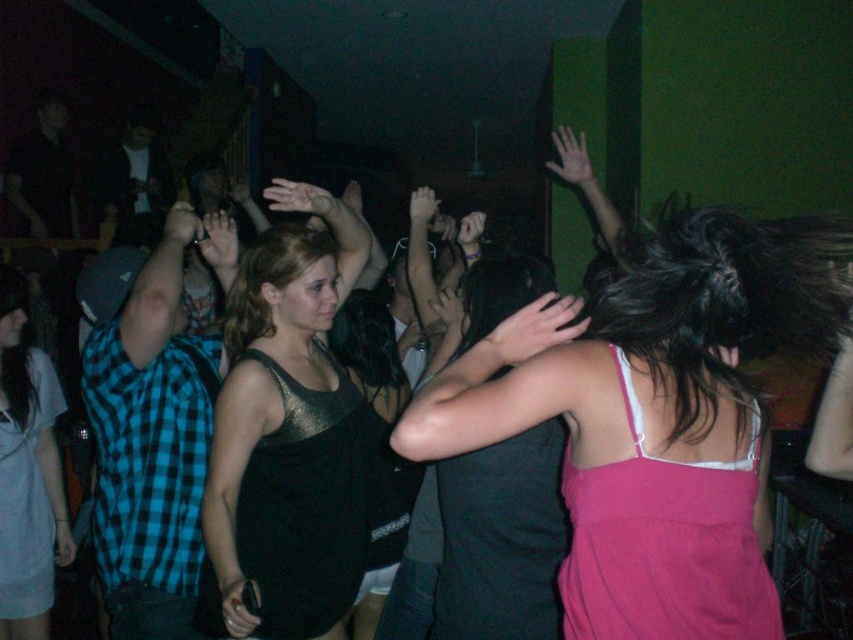
You are at a party and want to hand a drink to both the pink fabric dress at center and the metallic tank top at center. Which one should you approach first based on their positions?

The pink fabric dress at center is closer to the viewer than the metallic tank top at center, so you should approach the pink fabric dress at center first.

You are standing in the nightclub scene and want to move from the point at coordinate point (723,552) to the point at coordinate point (16,538). Which direction should you move to get closer to your destination?

Since point (723,552) is closer to the viewer than point (16,538), you should move backward to get closer to your destination.

You are a photographer standing at the entrance of the nightclub. You want to take a photo of the pink fabric dress at center without moving any objects. Can you adjust your position to ensure the dress is in focus while keeping it centered in the frame?

The pink fabric dress at center is 1.27 meters away from the camera. Since photographers can adjust their position to focus on subjects at that distance, you can move closer or use appropriate lens settings to ensure the dress remains centered and in focus.